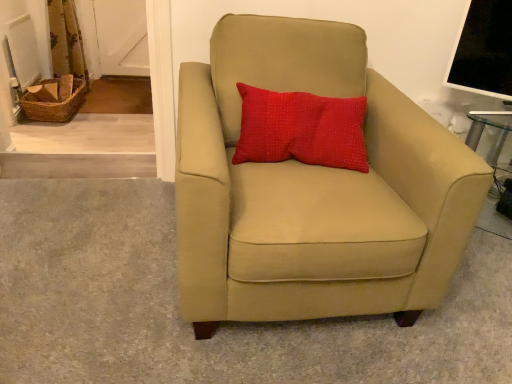
Question: Is point click(69, 64) positioned closer to the camera than point click(297, 61)?

Choices:
 (A) farther
 (B) closer

Answer: (A)

Question: Considering the positions of floral fabric curtain at upper left and suede beige armchair at center in the image, is floral fabric curtain at upper left taller or shorter than suede beige armchair at center?

Choices:
 (A) short
 (B) tall

Answer: (A)

Question: Based on their relative distances, which object is farther from the floral fabric curtain at upper left?

Choices:
 (A) suede beige armchair at center
 (B) red textured pillow at upper center

Answer: (A)

Question: Which of these objects is positioned closest to the floral fabric curtain at upper left?

Choices:
 (A) suede beige armchair at center
 (B) red textured pillow at upper center

Answer: (B)